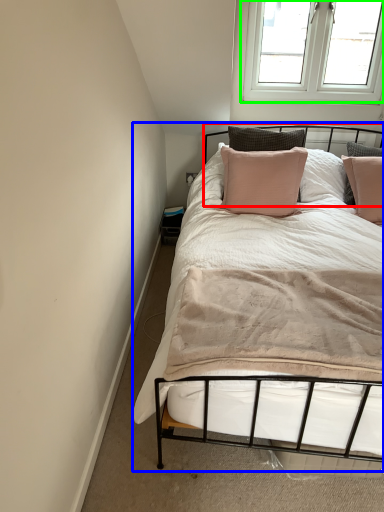
Question: Considering the real-world distances, which object is closest to headboard (highlighted by a red box)? bed (highlighted by a blue box) or window (highlighted by a green box).

Choices:
 (A) bed
 (B) window

Answer: (B)